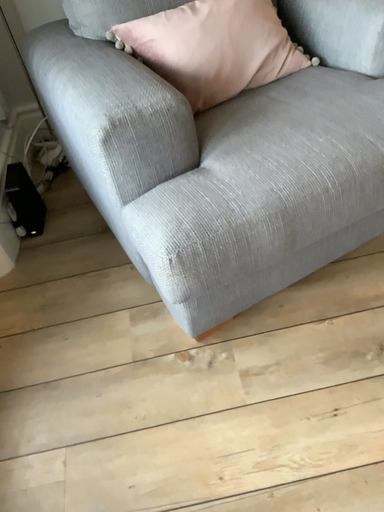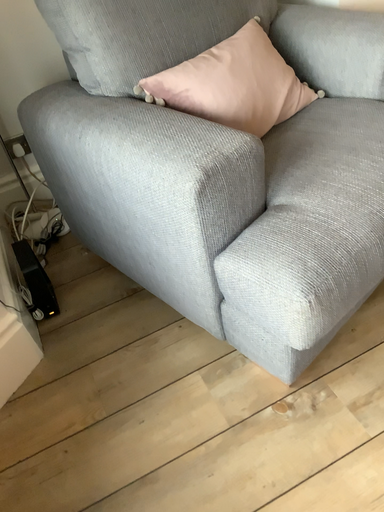
Question: How did the camera likely rotate when shooting the video?

Choices:
 (A) rotated right
 (B) rotated left

Answer: (A)